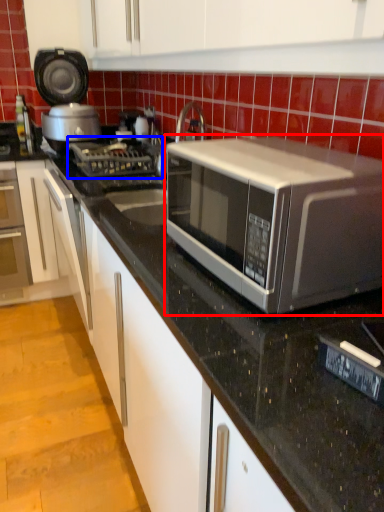
Question: Which of the following is the farthest to the observer, microwave oven (highlighted by a red box) or gas stove (highlighted by a blue box)?

Choices:
 (A) microwave oven
 (B) gas stove

Answer: (B)